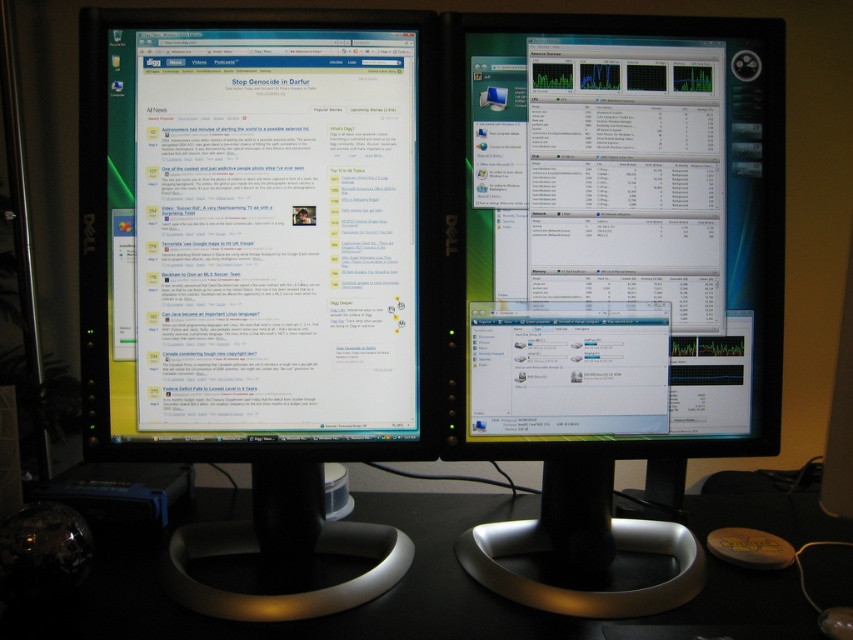
You are setting up a new monitor on the desk. The existing black glossy monitor at left is currently above the black plastic computer desk at center. Is there enough vertical space on the desk to place the new monitor below the existing one?

The black glossy monitor at left is above the black plastic computer desk at center, which means there is space below it on the desk to place the new monitor.

You are a technician who needs to adjust the settings on the black glossy monitor at left. You have a tool that requires you to be within 30 inches to operate effectively. Can you use the tool from your current position?

The black glossy monitor at left and the viewer are 29.26 inches apart, so yes, the technician can use the tool from their current position since the distance is within the 30 inches requirement.

You are sitting at the desk and want to adjust the position of the black glossy monitor at left so that it is closer to the black plastic computer desk at center. Is the monitor currently positioned closer to you or farther away from you compared to the desk?

The black glossy monitor at left is further to the viewer than the black plastic computer desk at center, meaning it is closer to you. To move it closer to the desk, you would need to push it away from you towards the desk.